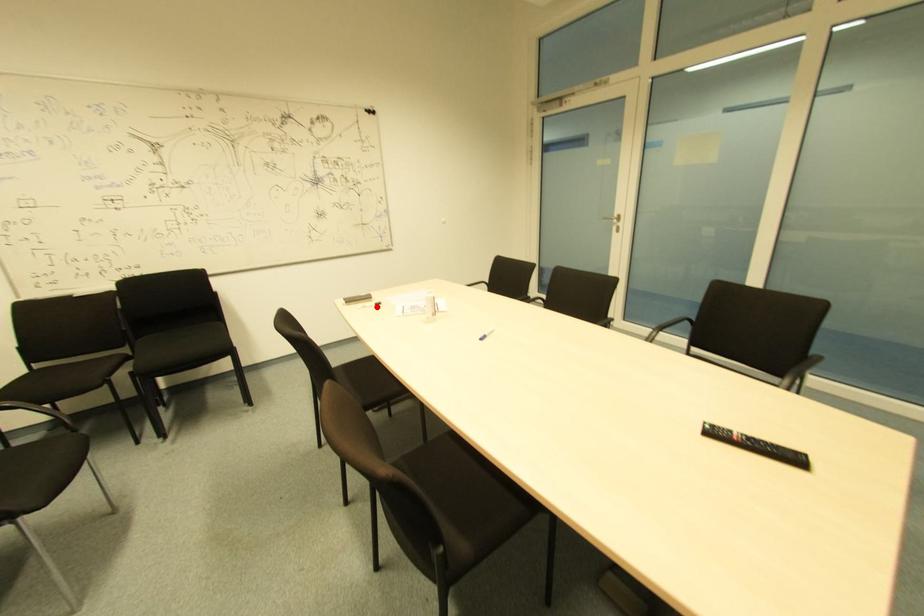
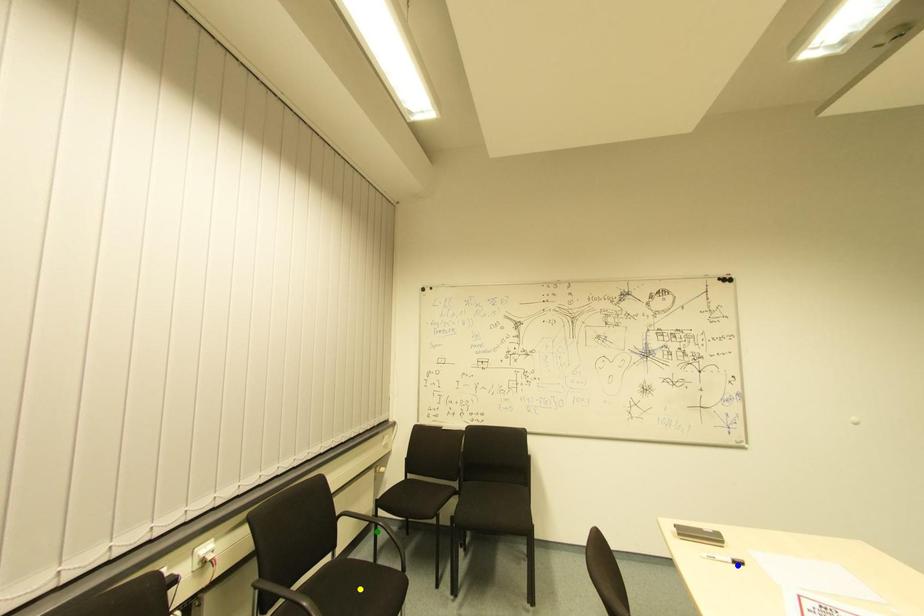
Question: I am providing you with two images of the same scene from different viewpoints. A red point is marked on the first image. You are given multiple points on the second image. In image 2, which mark is for the same physical point as the one in image 1?

Choices:
 (A) green point
 (B) yellow point
 (C) blue point

Answer: (C)